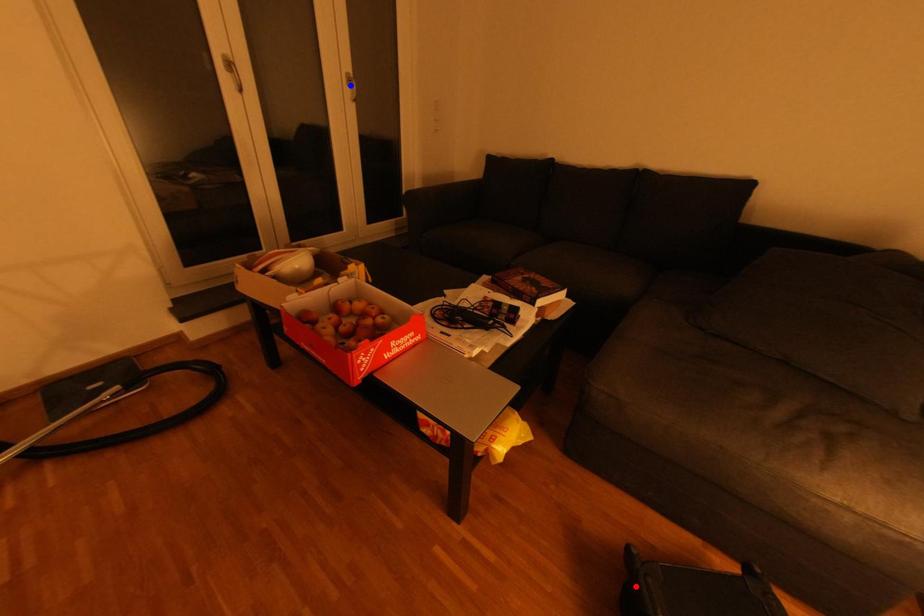
Question: In the image, two points are highlighted. Which point is nearer to the camera? Reply with the corresponding letter.

Choices:
 (A) blue point
 (B) red point

Answer: (B)